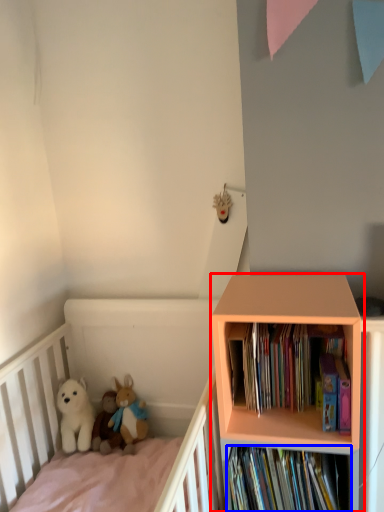
Question: Which object is further to the camera taking this photo, bookcase (highlighted by a red box) or book (highlighted by a blue box)?

Choices:
 (A) bookcase
 (B) book

Answer: (B)